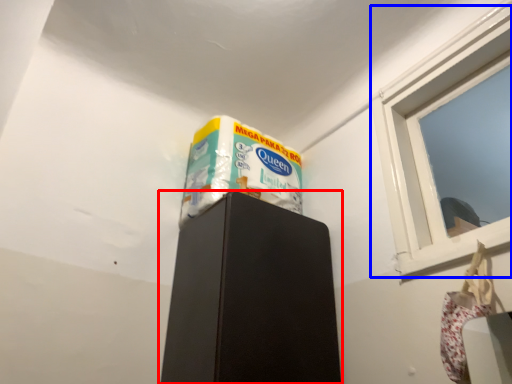
Question: Which of the following is the farthest to the observer, furniture (highlighted by a red box) or window (highlighted by a blue box)?

Choices:
 (A) furniture
 (B) window

Answer: (A)